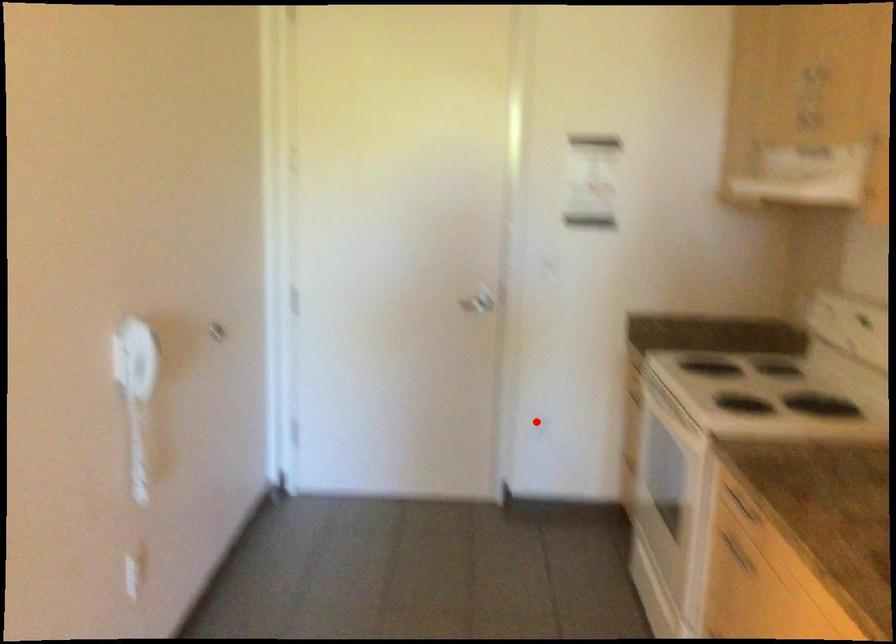
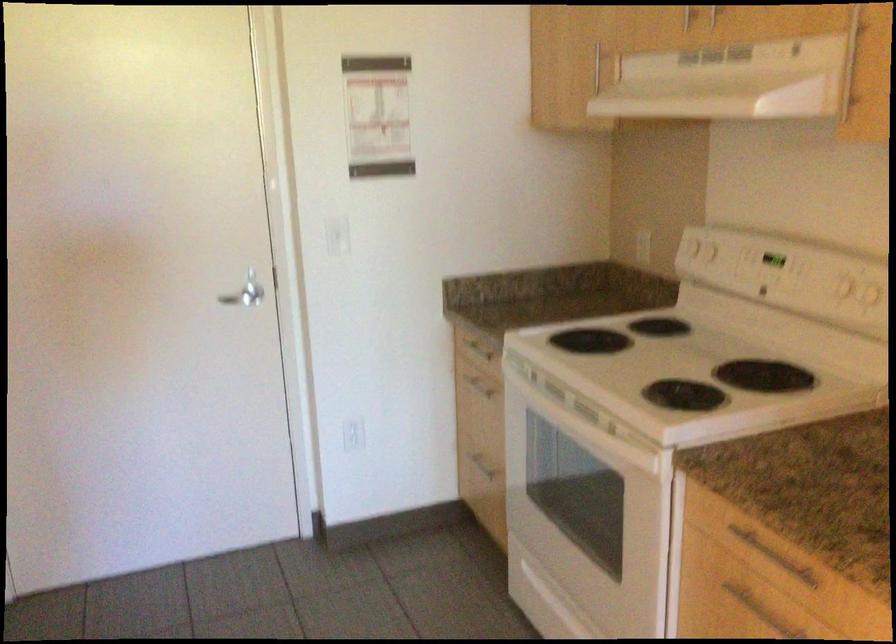
Locate, in the second image, the point that corresponds to the highlighted location in the first image.

(352, 433)